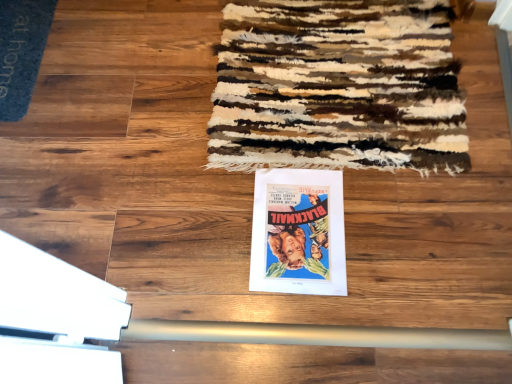
Identify the location of blank area to the left of matte paper poster at center. Image resolution: width=512 pixels, height=384 pixels. (202, 229).